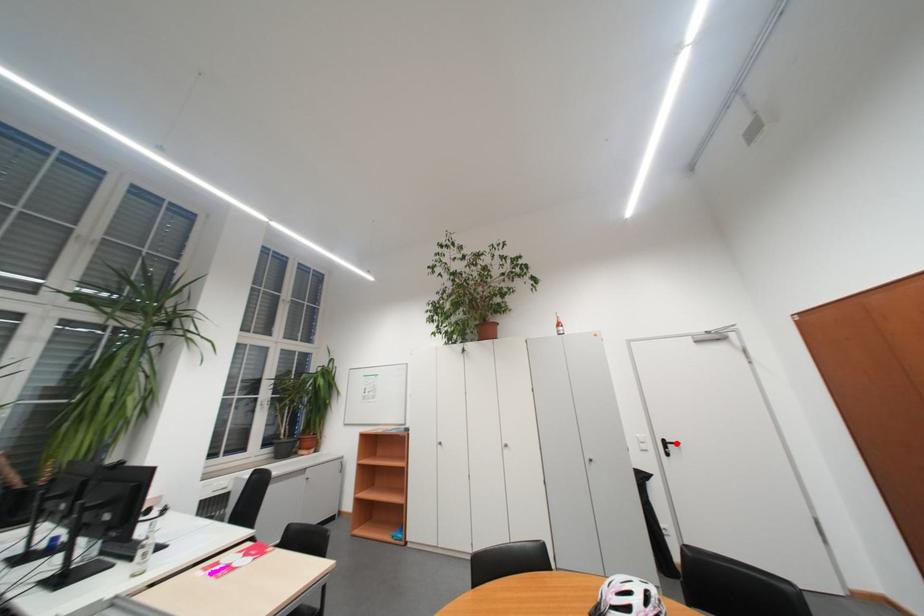
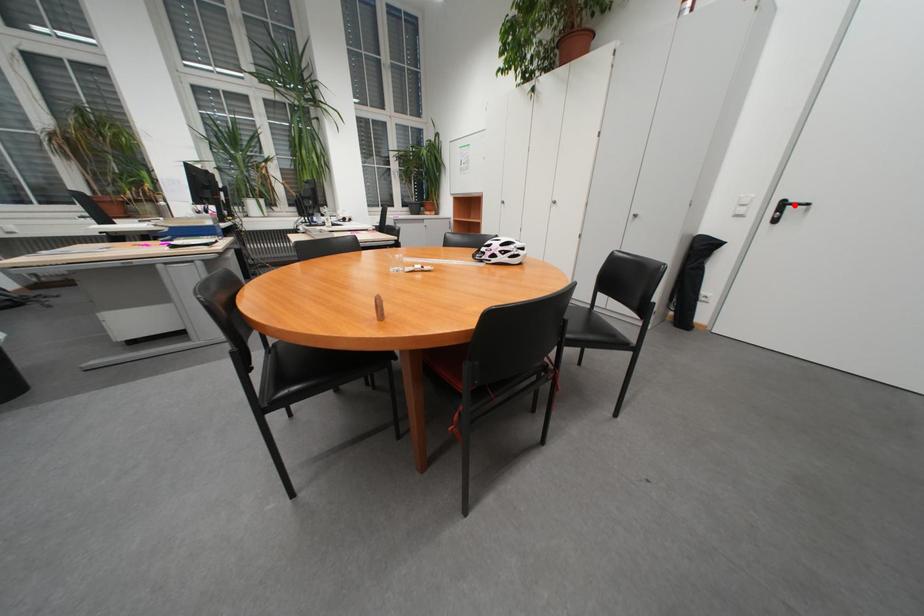
I am providing you with two images of the same scene from different viewpoints. A red point is marked on the first image and another point is marked on the second image. Is the red point in image1 aligned with the point shown in image2?

Yes